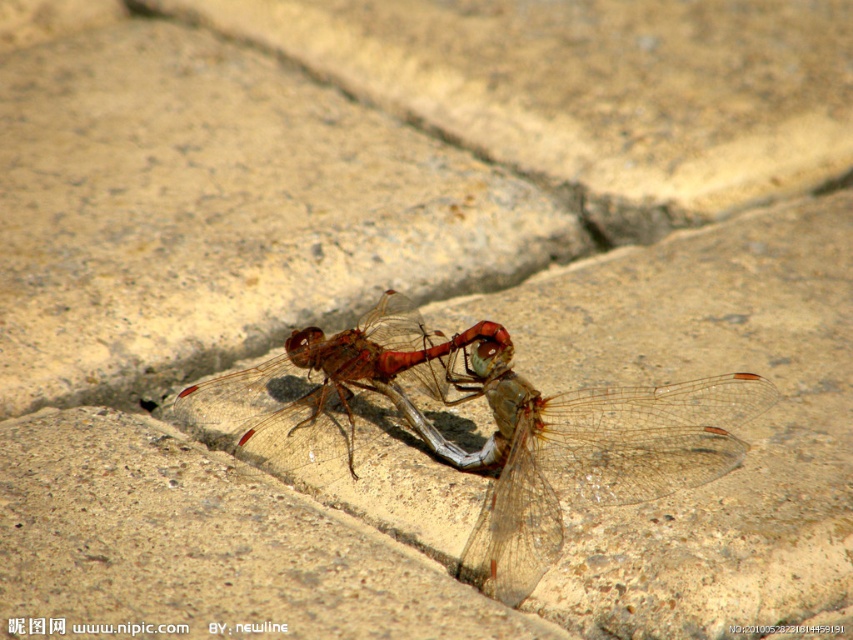
You are a researcher observing dragonflies in a natural habitat. You notice a translucent winged insect at center. Based on the coordinates provided, can you confirm if this insect is located at point (587, 456)?

Yes, the point (587, 456) indicates the location of the translucent winged insect at center, so the insect is indeed at that coordinate.

You are an entomologist observing two dragonflies on a stone surface. You notice the translucent winged insect at center and the translucent red dragonfly at center. Which of these two dragonflies has a larger height?

The translucent winged insect at center has a greater height compared to the translucent red dragonfly at center.